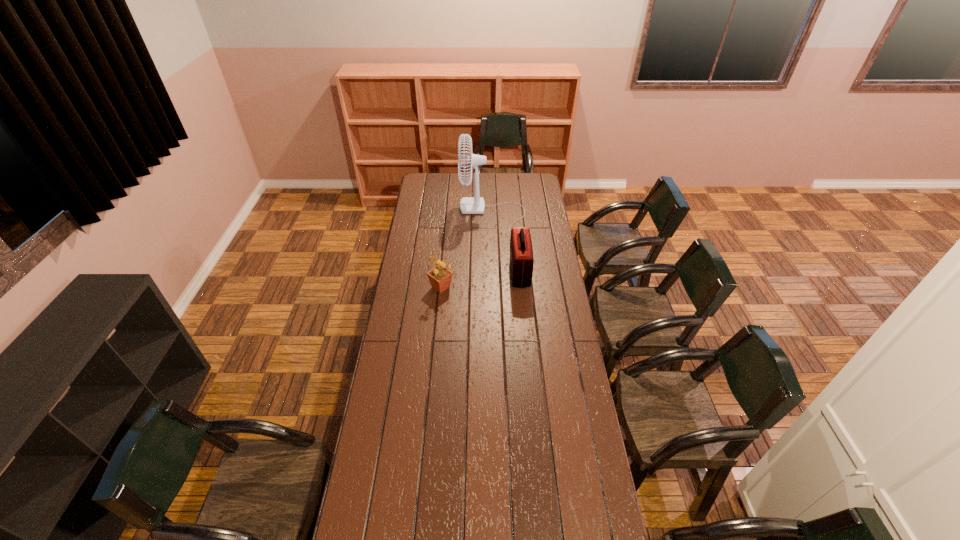
Find the location of a particular element. The height and width of the screenshot is (540, 960). free location located at the front of the sunflower with flowers visible is located at coordinates (439, 308).

Identify the location of object located at the left edge. The width and height of the screenshot is (960, 540). (440, 277).

The image size is (960, 540). What are the coordinates of `fan positioned at the right edge` in the screenshot? It's located at (468, 205).

You are a GUI agent. You are given a task and a screenshot of the screen. Output one action in this format:
    pyautogui.click(x=<x>, y=<y>)
    Task: Click on the first aid kit that is at the right edge
    This screenshot has width=960, height=540.
    Given the screenshot: What is the action you would take?
    pyautogui.click(x=521, y=252)

The image size is (960, 540). What are the coordinates of `vacant space at the left edge of the desktop` in the screenshot? It's located at (396, 523).

I want to click on free space at the right edge of the desktop, so click(581, 440).

Find the location of a particular element. The height and width of the screenshot is (540, 960). blank area at the far left corner is located at coordinates (419, 187).

Find the location of a particular element. The image size is (960, 540). vacant point located between the fan and the first aid kit is located at coordinates (506, 243).

The width and height of the screenshot is (960, 540). I want to click on vacant space that is in between the farthest object and the first aid kit, so click(x=506, y=243).

Point out which object is positioned as the second nearest to the farthest object. Please provide its 2D coordinates. Your answer should be formatted as a tuple, i.e. [(x, y)], where the tuple contains the x and y coordinates of a point satisfying the conditions above.

[(440, 277)]